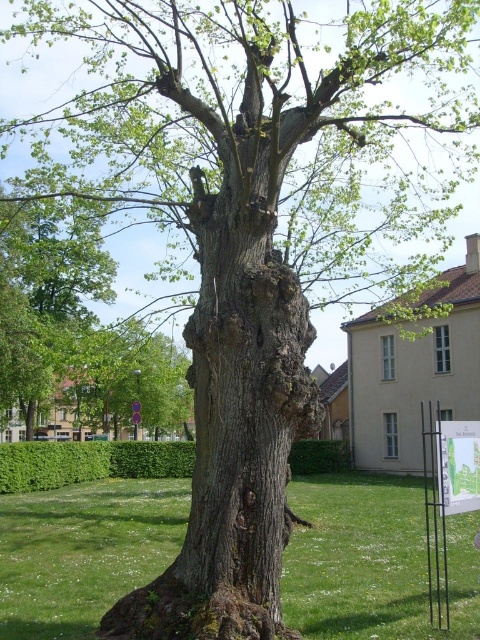
Question: Which of the following is the farthest from the observer?

Choices:
 (A) green grass at center
 (B) smooth bark tree at center

Answer: (B)

Question: Can you confirm if green grass at center is positioned above smooth bark tree at center?

Choices:
 (A) no
 (B) yes

Answer: (A)

Question: Can you confirm if green grass at center is positioned to the left of smooth bark tree at center?

Choices:
 (A) yes
 (B) no

Answer: (B)

Question: Among these points, which one is nearest to the camera?

Choices:
 (A) (127, 547)
 (B) (157, 428)

Answer: (A)

Question: Where is green grass at center located in relation to smooth bark tree at center in the image?

Choices:
 (A) left
 (B) right

Answer: (B)